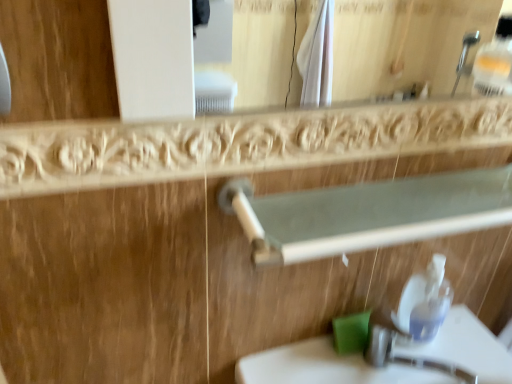
Question: From a real-world perspective, is green matte soap at lower center below white plastic rail at upper center?

Choices:
 (A) yes
 (B) no

Answer: (A)

Question: Is green matte soap at lower center thinner than white plastic rail at upper center?

Choices:
 (A) yes
 (B) no

Answer: (A)

Question: Does green matte soap at lower center have a larger size compared to white plastic rail at upper center?

Choices:
 (A) yes
 (B) no

Answer: (B)

Question: Is green matte soap at lower center aimed at white plastic rail at upper center?

Choices:
 (A) no
 (B) yes

Answer: (A)

Question: Does green matte soap at lower center have a smaller size compared to white plastic rail at upper center?

Choices:
 (A) yes
 (B) no

Answer: (A)

Question: Is white plastic rail at upper center completely or partially inside green matte soap at lower center?

Choices:
 (A) no
 (B) yes

Answer: (A)

Question: Is the position of green matte soap at lower center more distant than that of white glossy sink at lower center?

Choices:
 (A) no
 (B) yes

Answer: (B)

Question: From the image's perspective, would you say green matte soap at lower center is shown under white glossy sink at lower center?

Choices:
 (A) yes
 (B) no

Answer: (B)

Question: Does green matte soap at lower center have a lesser width compared to white glossy sink at lower center?

Choices:
 (A) yes
 (B) no

Answer: (A)

Question: From a real-world perspective, is green matte soap at lower center on top of white glossy sink at lower center?

Choices:
 (A) yes
 (B) no

Answer: (A)

Question: Does green matte soap at lower center appear on the right side of white glossy sink at lower center?

Choices:
 (A) yes
 (B) no

Answer: (B)

Question: Can you confirm if green matte soap at lower center is taller than white glossy sink at lower center?

Choices:
 (A) no
 (B) yes

Answer: (A)

Question: Is white glossy sink at lower center far from green matte soap at lower center?

Choices:
 (A) no
 (B) yes

Answer: (A)